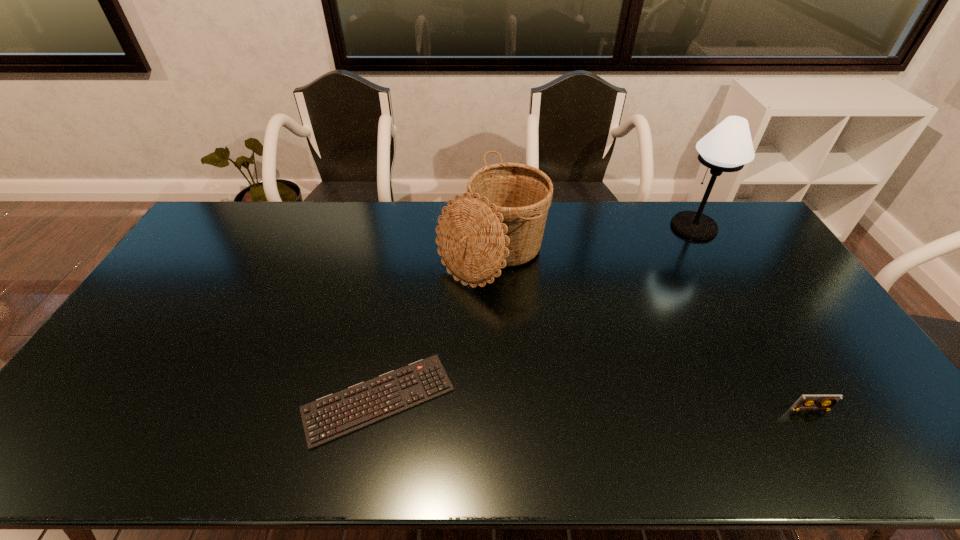
Locate an element on the screen. The height and width of the screenshot is (540, 960). the tallest object is located at coordinates (728, 147).

The image size is (960, 540). Find the location of `the third shortest object`. the third shortest object is located at coordinates (501, 222).

You are a GUI agent. You are given a task and a screenshot of the screen. Output one action in this format:
    pyautogui.click(x=<x>, y=<y>)
    Task: Click on the videotape
    The height and width of the screenshot is (540, 960).
    Given the screenshot: What is the action you would take?
    pyautogui.click(x=807, y=402)

In order to click on the shortest object in this screenshot , I will do `click(336, 415)`.

The height and width of the screenshot is (540, 960). In order to click on free space located 0.310m on the front of the table lamp in this screenshot , I will do `click(739, 307)`.

The width and height of the screenshot is (960, 540). What are the coordinates of `free space located on the left of the second tallest object` in the screenshot? It's located at (377, 251).

The height and width of the screenshot is (540, 960). Find the location of `vacant region located 0.080m at the front of the second shortest object with visible reels`. vacant region located 0.080m at the front of the second shortest object with visible reels is located at coordinates (829, 442).

The height and width of the screenshot is (540, 960). I want to click on vacant area situated 0.230m on the right of the computer keyboard, so click(544, 400).

Locate an element on the screen. This screenshot has width=960, height=540. table lamp that is positioned at the far edge is located at coordinates (728, 147).

Where is `basket at the far edge`? basket at the far edge is located at coordinates (501, 222).